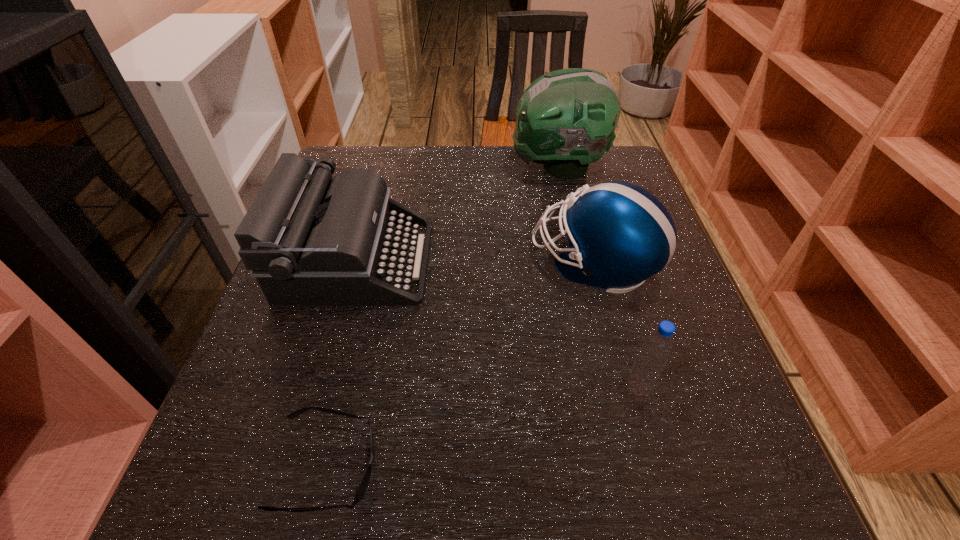
Where is `water bottle at the right edge`? water bottle at the right edge is located at coordinates (657, 348).

Where is `object present at the near left corner`? The height and width of the screenshot is (540, 960). object present at the near left corner is located at coordinates (363, 484).

Identify the location of object that is at the far right corner. The height and width of the screenshot is (540, 960). (566, 119).

I want to click on free region at the far edge of the desktop, so (462, 149).

The width and height of the screenshot is (960, 540). What are the coordinates of `vacant region at the near edge of the desktop` in the screenshot? It's located at point(410,470).

Where is `vacant region at the right edge of the desktop`? This screenshot has width=960, height=540. vacant region at the right edge of the desktop is located at coordinates (693, 402).

The image size is (960, 540). In the image, there is a desktop. What are the coordinates of `vacant space at the near left corner` in the screenshot? It's located at (275, 464).

Image resolution: width=960 pixels, height=540 pixels. In the image, there is a desktop. In order to click on blank space at the far right corner in this screenshot , I will do `click(625, 180)`.

Locate an element on the screen. The width and height of the screenshot is (960, 540). free space between the nearer football helmet and the typewriter is located at coordinates (475, 262).

At what (x,y) coordinates should I click in order to perform the action: click on free space that is in between the farther football helmet and the sunglasses. Please return your answer as a coordinate pair (x, y). The image size is (960, 540). Looking at the image, I should click on (444, 317).